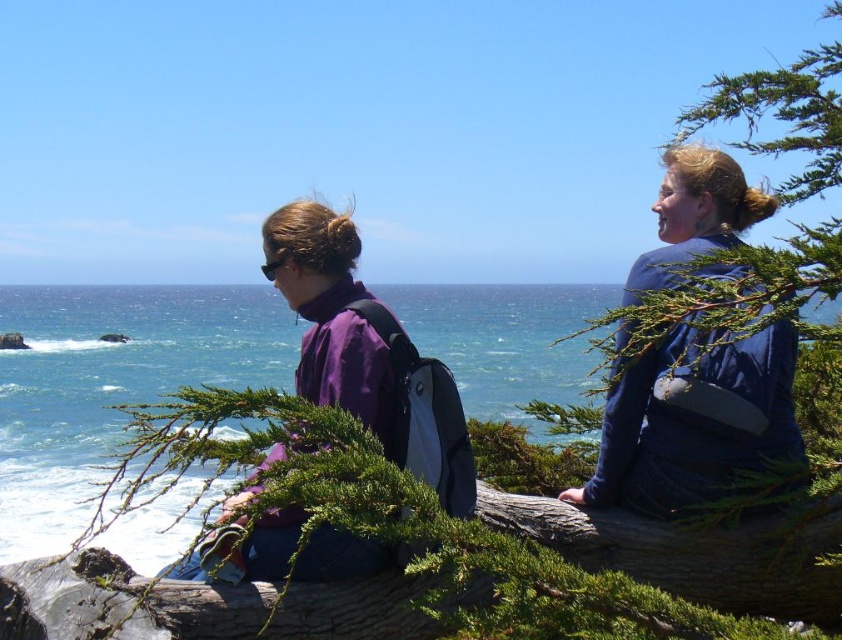
You are planning to take a photo of the blue fabric jacket at upper right and the blue water at center from a distance. Which object will appear smaller in the photo?

The blue water at center will appear smaller in the photo because it is farther away from the blue fabric jacket at upper right. The blue water at center is 476.81 feet away from the blue fabric jacket at upper right, meaning it is much farther and thus appears smaller.

In the scene shown: You are planning to take a photo of the blue fabric jacket at upper right and the purple matte jacket at center. Which jacket should you focus on first if you want to capture both in the same frame without moving the camera?

The blue fabric jacket at upper right is shorter than the purple matte jacket at center, so you should focus on the blue fabric jacket at upper right first to ensure both are in frame.